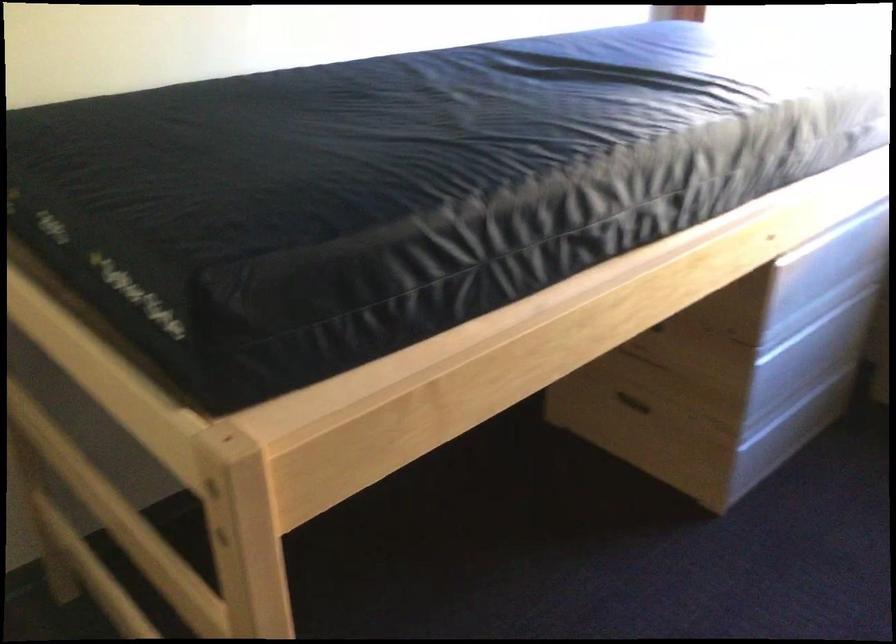
What do you see at coordinates (237, 183) in the screenshot? This screenshot has height=644, width=896. I see `the black mattress surface` at bounding box center [237, 183].